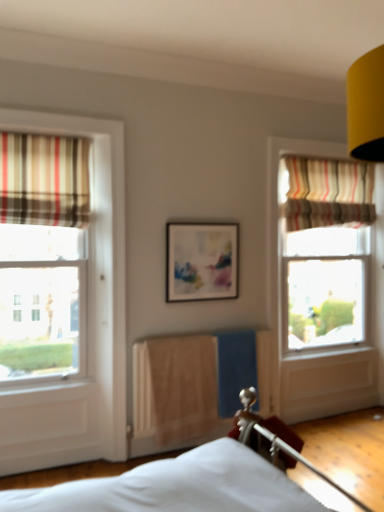
Question: Is beige fabric radiator at center thinner than striped fabric curtain at upper right, which is the second curtain in left-to-right order?

Choices:
 (A) yes
 (B) no

Answer: (A)

Question: Is beige fabric radiator at center at the right side of striped fabric curtain at upper right, which is the second curtain in left-to-right order?

Choices:
 (A) yes
 (B) no

Answer: (B)

Question: From the image's perspective, is beige fabric radiator at center over striped fabric curtain at upper right, which ranks as the 2th curtain in front-to-back order?

Choices:
 (A) no
 (B) yes

Answer: (A)

Question: Is beige fabric radiator at center shorter than striped fabric curtain at upper right, which is the second curtain in left-to-right order?

Choices:
 (A) yes
 (B) no

Answer: (B)

Question: Is the depth of beige fabric radiator at center greater than that of striped fabric curtain at upper right, acting as the first curtain starting from the right?

Choices:
 (A) no
 (B) yes

Answer: (A)

Question: Visually, is striped fabric curtain at left, the 2th curtain positioned from the back, positioned to the left or to the right of striped fabric curtain at upper right, which is the second curtain in left-to-right order?

Choices:
 (A) left
 (B) right

Answer: (A)

Question: From the image's perspective, is striped fabric curtain at left, which is the 2th curtain in right-to-left order, located above or below striped fabric curtain at upper right, acting as the first curtain starting from the right?

Choices:
 (A) above
 (B) below

Answer: (B)

Question: Is striped fabric curtain at left, the 2th curtain positioned from the back, bigger or smaller than striped fabric curtain at upper right, acting as the first curtain starting from the right?

Choices:
 (A) big
 (B) small

Answer: (B)

Question: Choose the correct answer: Is striped fabric curtain at left, which is the 2th curtain in right-to-left order, inside striped fabric curtain at upper right, which is the second curtain in left-to-right order, or outside it?

Choices:
 (A) outside
 (B) inside

Answer: (A)

Question: Is striped fabric curtain at upper right, which is the second curtain in left-to-right order, taller or shorter than striped fabric curtain at left, the 1th curtain in the front-to-back sequence?

Choices:
 (A) short
 (B) tall

Answer: (B)

Question: From a real-world perspective, is striped fabric curtain at upper right, which appears as the 1th curtain when viewed from the back, positioned above or below striped fabric curtain at left, the 1th curtain in the front-to-back sequence?

Choices:
 (A) below
 (B) above

Answer: (A)

Question: Is striped fabric curtain at upper right, which appears as the 1th curtain when viewed from the back, in front of or behind striped fabric curtain at left, positioned as the first curtain in left-to-right order, in the image?

Choices:
 (A) behind
 (B) front

Answer: (A)

Question: Looking at the image, does striped fabric curtain at upper right, which appears as the 1th curtain when viewed from the back, seem bigger or smaller compared to striped fabric curtain at left, which is the 2th curtain in right-to-left order?

Choices:
 (A) big
 (B) small

Answer: (A)

Question: Does point (301, 176) appear closer or farther from the camera than point (216, 266)?

Choices:
 (A) farther
 (B) closer

Answer: (A)

Question: Is striped fabric curtain at upper right, acting as the first curtain starting from the right, spatially inside matte plastic picture frame at center, or outside of it?

Choices:
 (A) outside
 (B) inside

Answer: (A)